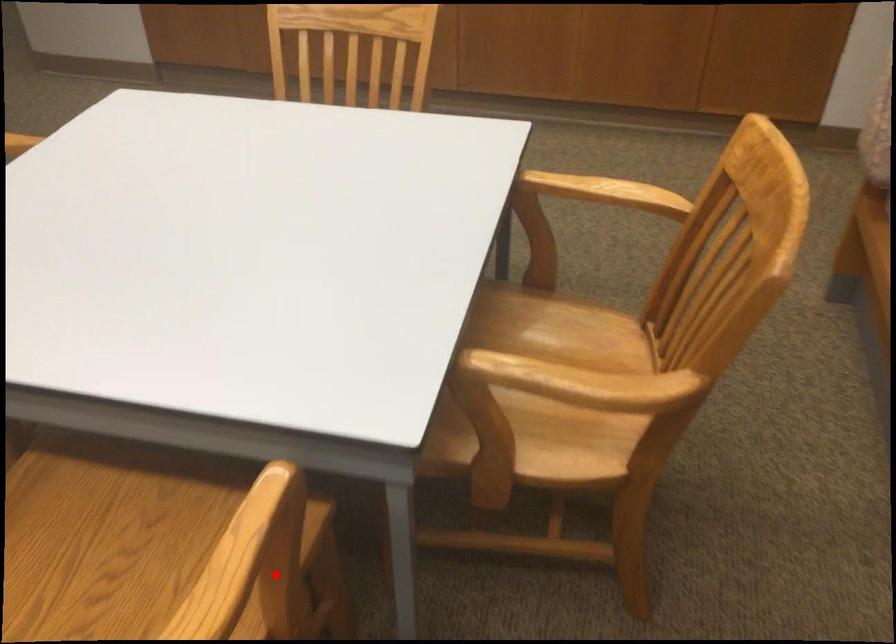
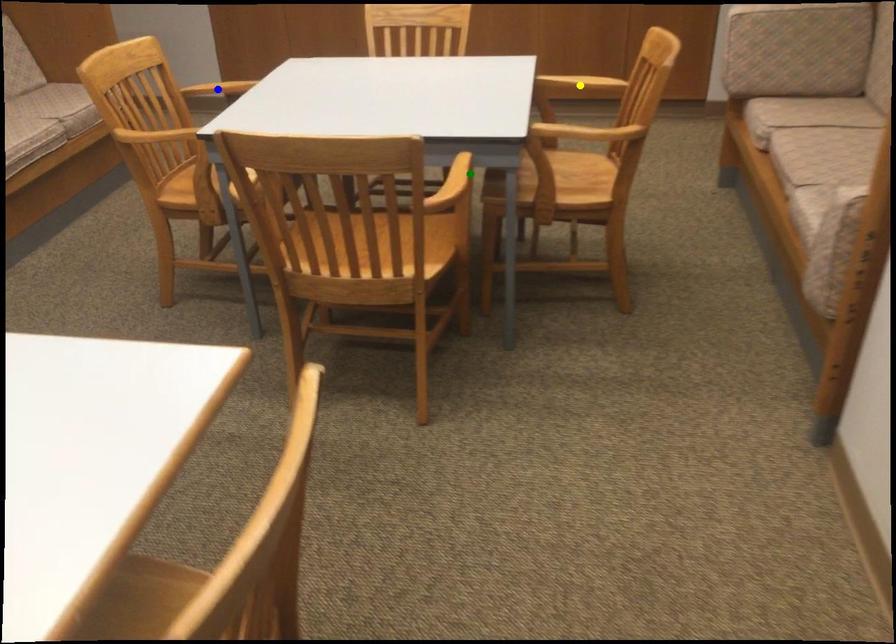
Question: I am providing you with two images of the same scene from different viewpoints. A red point is marked on the first image. You are given multiple points on the second image. In image 2, which mark is for the same physical point as the one in image 1?

Choices:
 (A) green point
 (B) blue point
 (C) yellow point

Answer: (A)